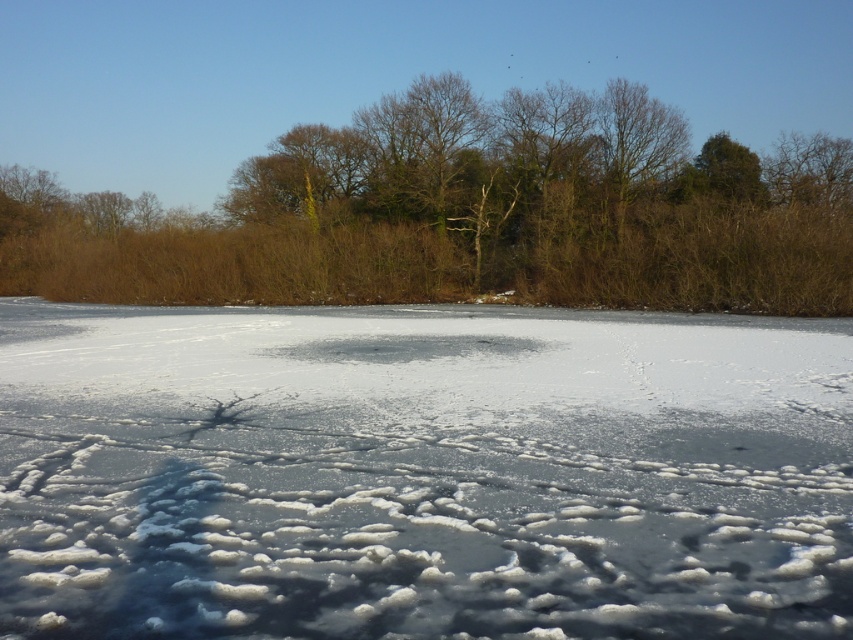
Between point (428, 333) and point (849, 282), which one is positioned behind?

Positioned behind is point (849, 282).

Measure the distance from transparent ice at center to brown/drytree at upper center.

transparent ice at center is 30.48 meters from brown/drytree at upper center.

Find the location of a particular element. The width and height of the screenshot is (853, 640). transparent ice at center is located at coordinates (422, 472).

Locate an element on the screen. This screenshot has width=853, height=640. transparent ice at center is located at coordinates (422, 472).